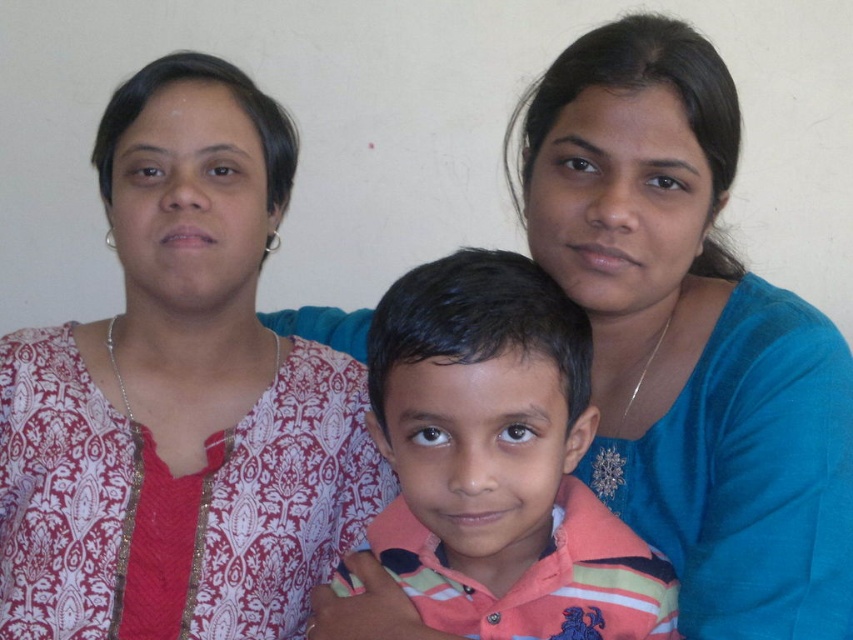
Between blue fabric at upper right and striped cotton shirt at center, which one has less height?

striped cotton shirt at center

Is blue fabric at upper right closer to the viewer compared to striped cotton shirt at center?

No, it is not.

This screenshot has width=853, height=640. What do you see at coordinates (689, 337) in the screenshot?
I see `blue fabric at upper right` at bounding box center [689, 337].

Where is `blue fabric at upper right`? The width and height of the screenshot is (853, 640). blue fabric at upper right is located at coordinates click(x=689, y=337).

Is patterned fabric shirt at left above blue fabric at upper right?

No.

Who is more distant from viewer, (238, 129) or (730, 106)?

Point (238, 129)

I want to click on patterned fabric shirt at left, so click(x=180, y=397).

Can you confirm if patterned fabric shirt at left is bigger than striped cotton shirt at center?

Yes.

Does patterned fabric shirt at left have a greater width compared to striped cotton shirt at center?

Correct, the width of patterned fabric shirt at left exceeds that of striped cotton shirt at center.

Locate an element on the screen. The width and height of the screenshot is (853, 640). patterned fabric shirt at left is located at coordinates (180, 397).